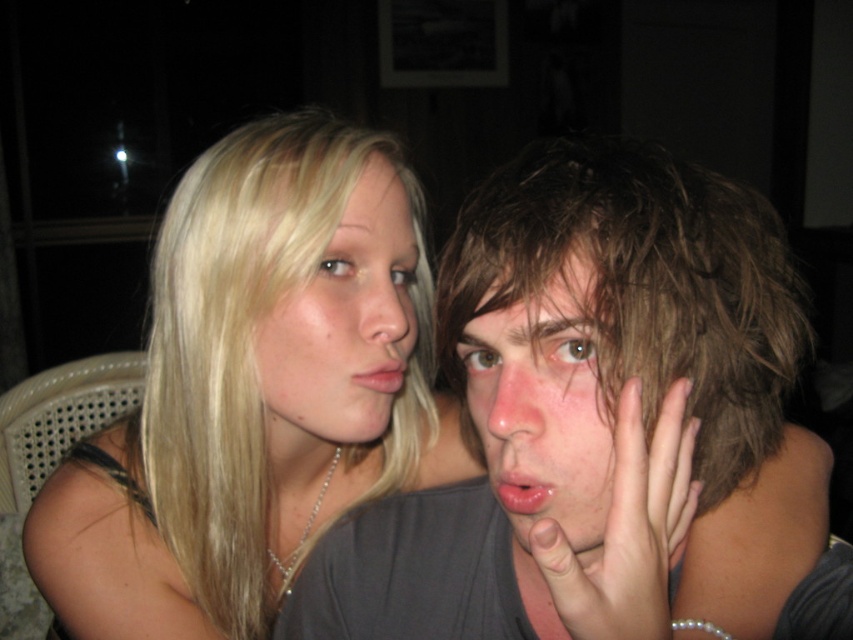
Question: In this image, where is dry skin face at right located relative to blonde hair at center?

Choices:
 (A) below
 (B) above

Answer: (A)

Question: Is shaggy brown hair at center wider than glossy pink lips at center?

Choices:
 (A) yes
 (B) no

Answer: (A)

Question: Which point appears farthest from the camera in this image?

Choices:
 (A) (543, 502)
 (B) (202, 244)

Answer: (B)

Question: Which object is closer to the camera taking this photo?

Choices:
 (A) shaggy brown hair at center
 (B) matte pink lips at center
 (C) dry skin face at right

Answer: (A)

Question: Which point is closer to the camera?

Choices:
 (A) (599, 508)
 (B) (393, 266)
 (C) (517, 477)

Answer: (C)

Question: Is blonde hair at center further to the viewer compared to matte pink lips at center?

Choices:
 (A) yes
 (B) no

Answer: (B)